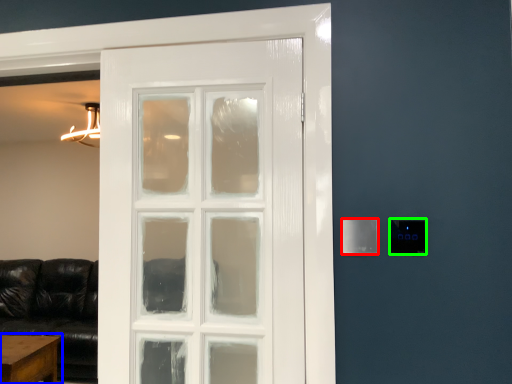
Question: Estimate the real-world distances between objects in this image. Which object is closer to light switch (highlighted by a red box), table (highlighted by a blue box) or light switch (highlighted by a green box)?

Choices:
 (A) table
 (B) light switch

Answer: (B)